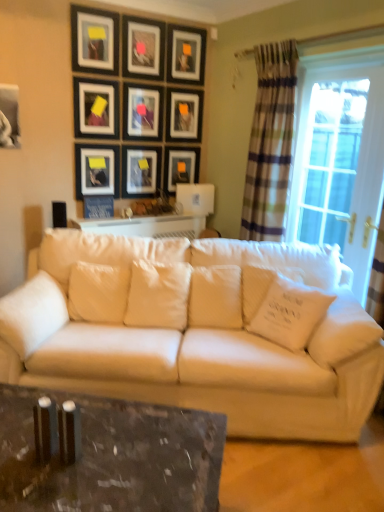
The height and width of the screenshot is (512, 384). Find the location of `free space above white textured pillow at right, the third pillow from the left (from a real-world perspective)`. free space above white textured pillow at right, the third pillow from the left (from a real-world perspective) is located at coordinates (274, 266).